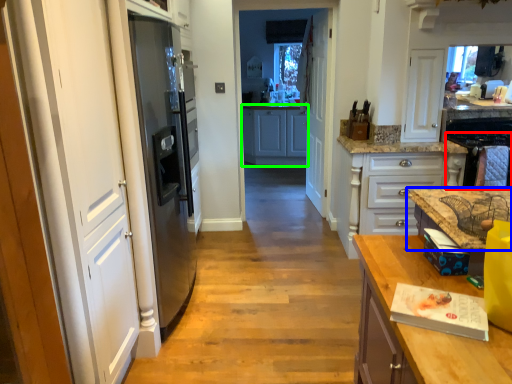
Question: Considering the real-world distances, which object is closest to oven (highlighted by a red box)? countertop (highlighted by a blue box) or cabinetry (highlighted by a green box).

Choices:
 (A) countertop
 (B) cabinetry

Answer: (A)